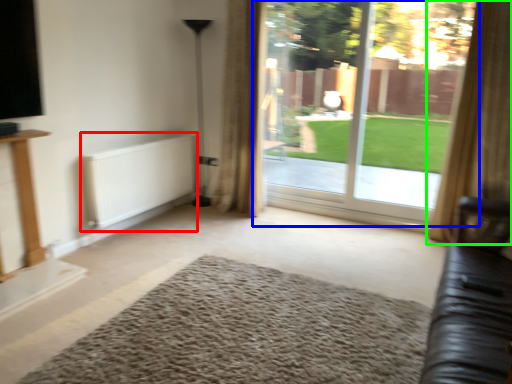
Question: Which is nearer to the radiator (highlighted by a red box)? window (highlighted by a blue box) or curtain (highlighted by a green box).

Choices:
 (A) window
 (B) curtain

Answer: (A)